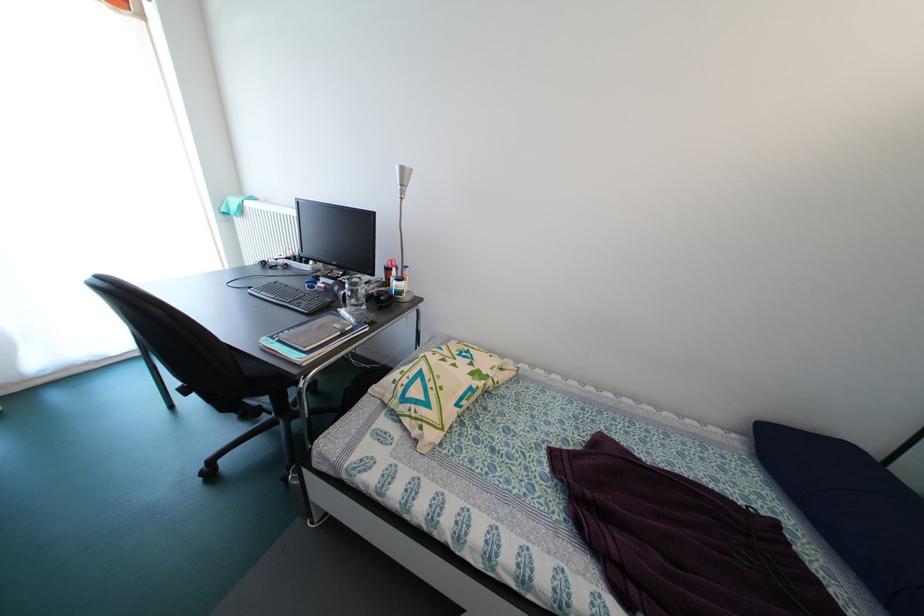
This screenshot has height=616, width=924. Find the location of `black computer mouse`. black computer mouse is located at coordinates (382, 298).